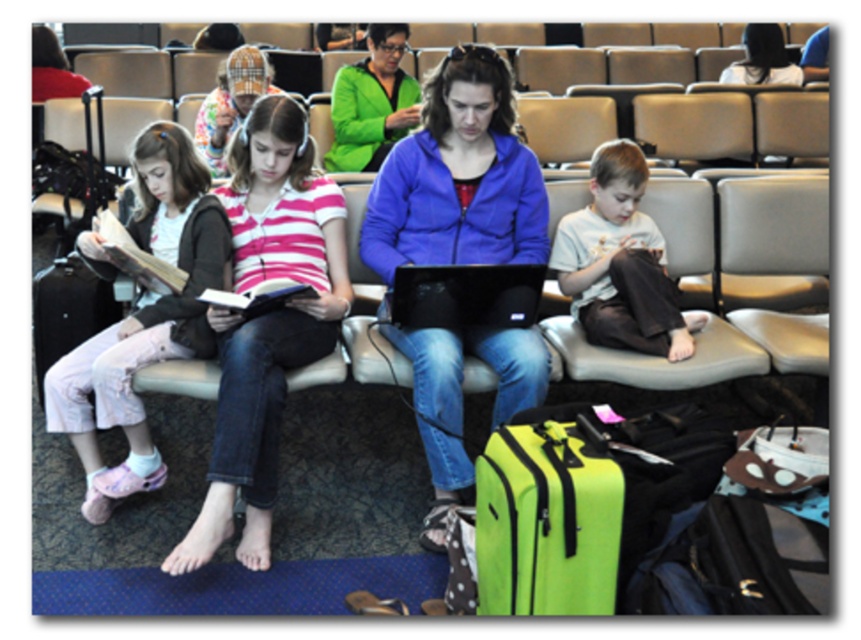
Question: Can you confirm if blue matte jacket at center is positioned above matte green jacket at upper center?

Choices:
 (A) no
 (B) yes

Answer: (A)

Question: Does light brown cotton pants at center appear over matte green jacket at upper center?

Choices:
 (A) yes
 (B) no

Answer: (B)

Question: Is green matte jacket at center further to camera compared to plaid fabric headscarf at upper center?

Choices:
 (A) no
 (B) yes

Answer: (B)

Question: Which of the following is the closest to the observer?

Choices:
 (A) (249, 305)
 (B) (333, 106)
 (C) (423, 273)

Answer: (A)

Question: Which of these objects is positioned closest to the matte pink book at center?

Choices:
 (A) green matte jacket at center
 (B) blue matte jacket at center
 (C) neon green fabric suitcase at lower center
 (D) plaid fabric headscarf at upper center

Answer: (B)

Question: Estimate the real-world distances between objects in this image. Which object is farther from the neon green fabric suitcase at lower center?

Choices:
 (A) matte pink book at center
 (B) pink striped shirt at center
 (C) plaid fabric headscarf at upper center
 (D) matte black suitcase at left

Answer: (C)